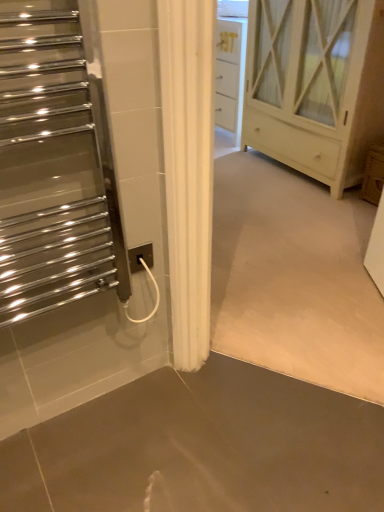
Question: Is point (29, 227) positioned closer to the camera than point (253, 2)?

Choices:
 (A) closer
 (B) farther

Answer: (A)

Question: Is polished chrome towel warmer at left taller or shorter than white wood cabinet at center?

Choices:
 (A) tall
 (B) short

Answer: (B)

Question: Based on their relative distances, which object is nearer to the smooth concrete floor at lower center?

Choices:
 (A) white wood cabinet at center
 (B) polished chrome towel warmer at left
 (C) white plastic electric outlet at center

Answer: (C)

Question: Based on their relative distances, which object is nearer to the smooth concrete floor at lower center?

Choices:
 (A) white plastic electric outlet at center
 (B) white wood cabinet at center
 (C) polished chrome towel warmer at left

Answer: (A)